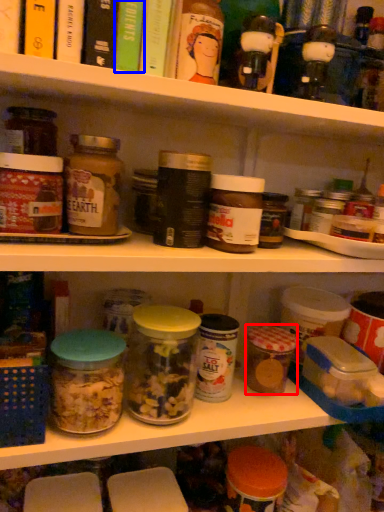
Question: Which object is further to the camera taking this photo, cereal (highlighted by a red box) or book (highlighted by a blue box)?

Choices:
 (A) cereal
 (B) book

Answer: (A)